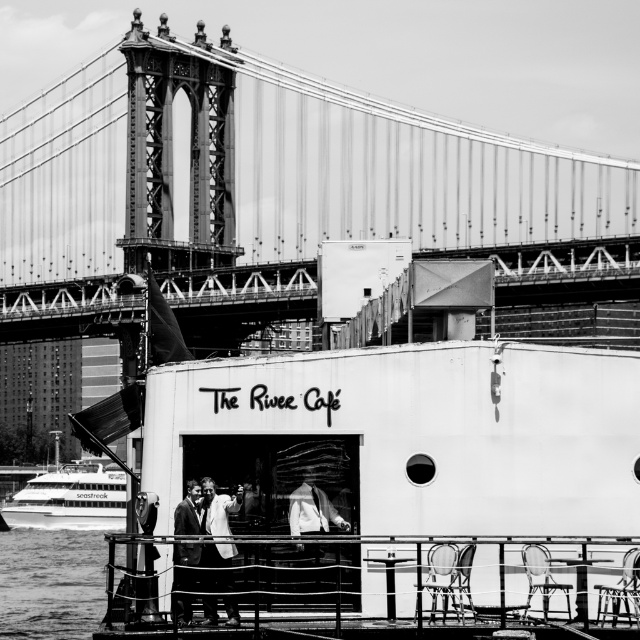
Is metallic bridge at upper center thinner than white fabric at center?

Incorrect, metallic bridge at upper center's width is not less than white fabric at center's.

Is metallic bridge at upper center shorter than white fabric at center?

In fact, metallic bridge at upper center may be taller than white fabric at center.

Between point (269, 298) and point (308, 532), which one is positioned behind?

Positioned behind is point (269, 298).

Where is `metallic bridge at upper center`? Image resolution: width=640 pixels, height=640 pixels. metallic bridge at upper center is located at coordinates (273, 195).

Can you confirm if smooth water at lower left is shorter than smooth leather jacket at center?

Incorrect, smooth water at lower left's height does not fall short of smooth leather jacket at center's.

Is point (84, 620) closer to viewer compared to point (184, 522)?

That is False.

Measure the distance between smooth water at lower left and camera.

smooth water at lower left is 87.43 meters away from camera.

The image size is (640, 640). Identify the location of smooth water at lower left. (51, 582).

Looking at this image, does white fabric coat at center lie behind white fabric at center?

No, it is not.

What do you see at coordinates (216, 508) in the screenshot?
I see `white fabric coat at center` at bounding box center [216, 508].

Where is `white fabric coat at center`? white fabric coat at center is located at coordinates (216, 508).